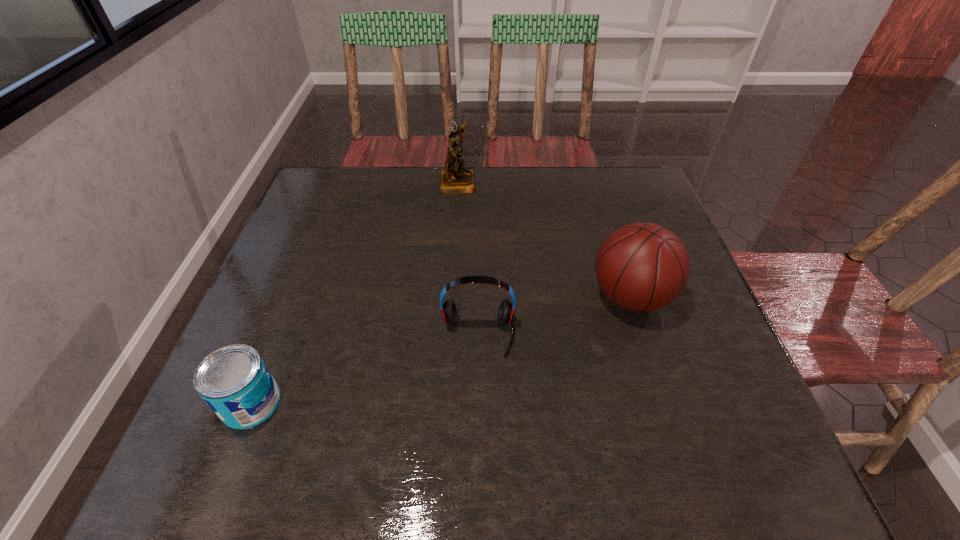
This screenshot has width=960, height=540. Identify the location of object present at the left edge. [234, 381].

The image size is (960, 540). In order to click on object present at the right edge in this screenshot , I will do `click(643, 267)`.

At what (x,y) coordinates should I click in order to perform the action: click on vacant space at the far edge of the desktop. Please return your answer as a coordinate pair (x, y). Looking at the image, I should click on (493, 193).

In the image, there is a desktop. Where is `blank space at the near edge`? The width and height of the screenshot is (960, 540). blank space at the near edge is located at coordinates (675, 477).

The height and width of the screenshot is (540, 960). I want to click on vacant space at the right edge of the desktop, so click(x=688, y=367).

Where is `vacant space at the far right corner of the desktop`? The height and width of the screenshot is (540, 960). vacant space at the far right corner of the desktop is located at coordinates (627, 171).

Find the location of a particular element. blank area at the near right corner is located at coordinates (770, 445).

Where is `free spot between the headset and the figurine`? free spot between the headset and the figurine is located at coordinates (468, 258).

I want to click on vacant space that is in between the rightmost object and the can, so click(x=441, y=349).

The width and height of the screenshot is (960, 540). In order to click on blank region between the rightmost object and the third tallest object in this screenshot , I will do `click(554, 315)`.